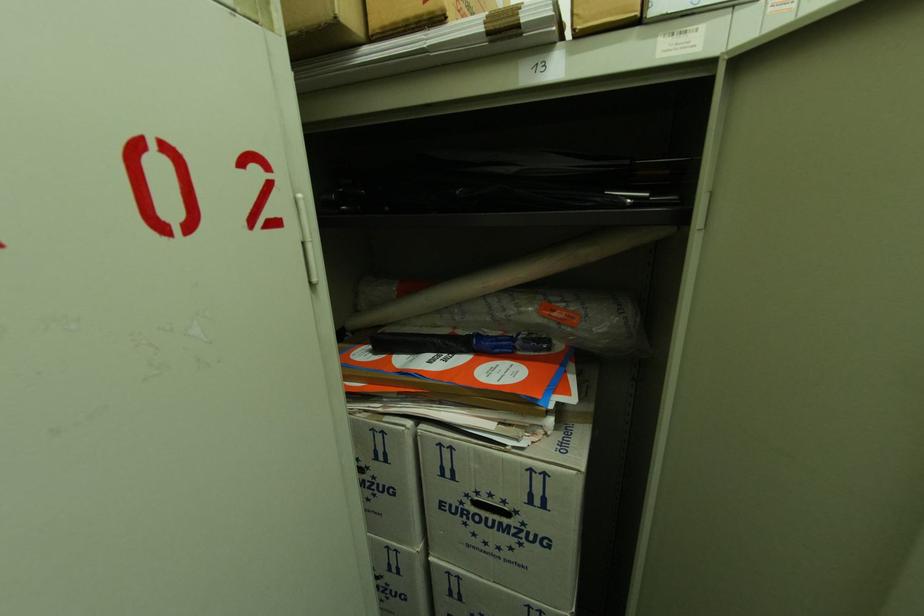
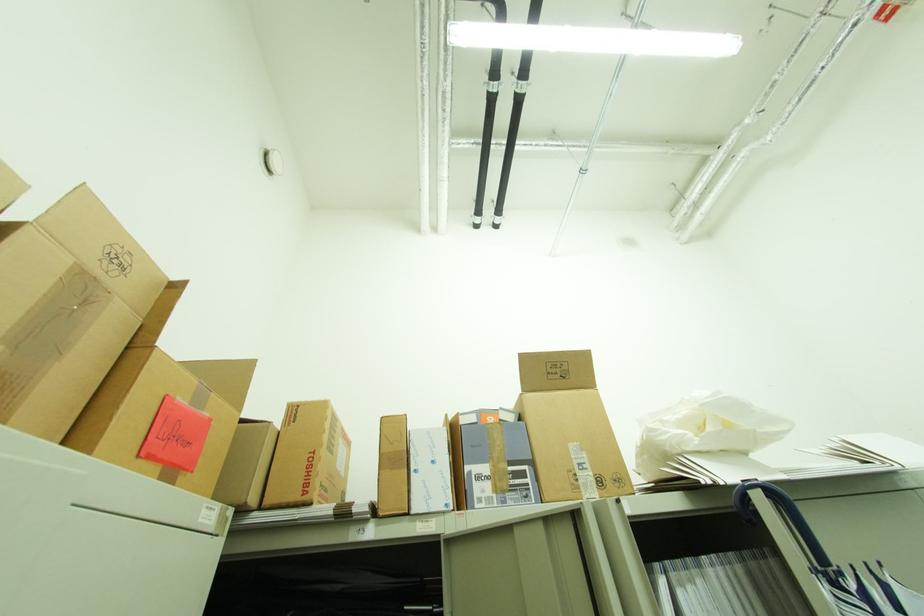
Based on the continuous images, in which direction is the camera rotating?

The camera's rotation is toward right-up.